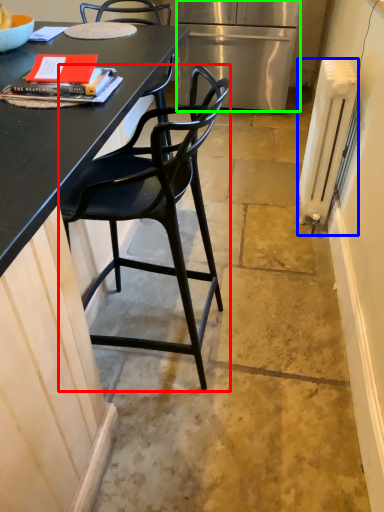
Question: Based on their relative distances, which object is farther from chair (highlighted by a red box)? Choose from radiator (highlighted by a blue box) and refrigerator (highlighted by a green box).

Choices:
 (A) radiator
 (B) refrigerator

Answer: (B)